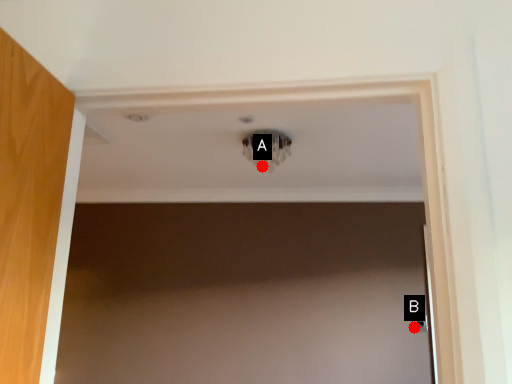
Question: Two points are circled on the image, labeled by A and B beside each circle. Which of the following is the farthest from the observer?

Choices:
 (A) A is further
 (B) B is further

Answer: (B)